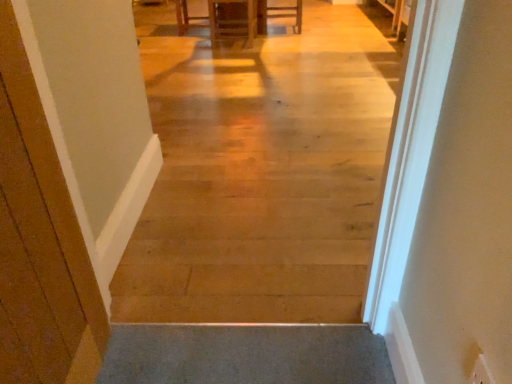
This screenshot has width=512, height=384. I want to click on spots to the right of wooden floor at center, so click(x=321, y=290).